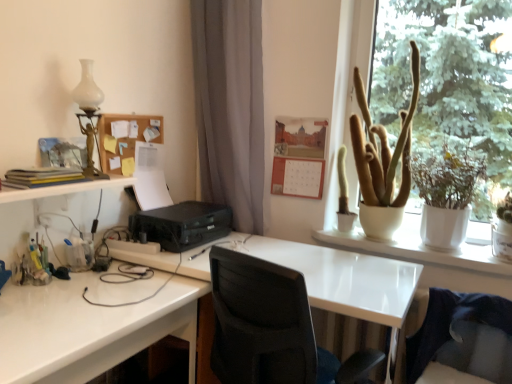
The height and width of the screenshot is (384, 512). In order to click on vacant space underneath matte yellow book at left (from a real-world perspective) in this screenshot , I will do `click(53, 284)`.